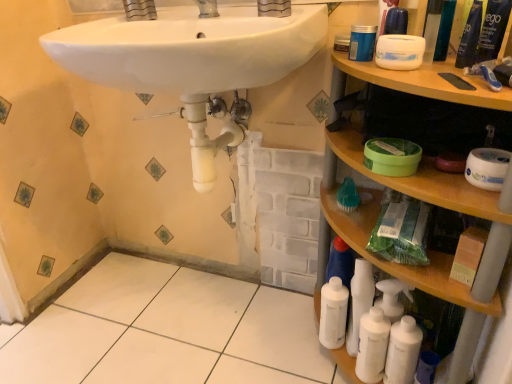
Image resolution: width=512 pixels, height=384 pixels. What are the coordinates of `vacant location behind white matte toothpaste at upper right` in the screenshot? It's located at (457, 69).